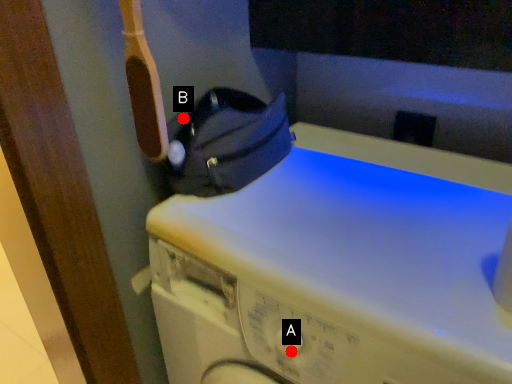
Question: Two points are circled on the image, labeled by A and B beside each circle. Which point is further to the camera?

Choices:
 (A) A is further
 (B) B is further

Answer: (B)